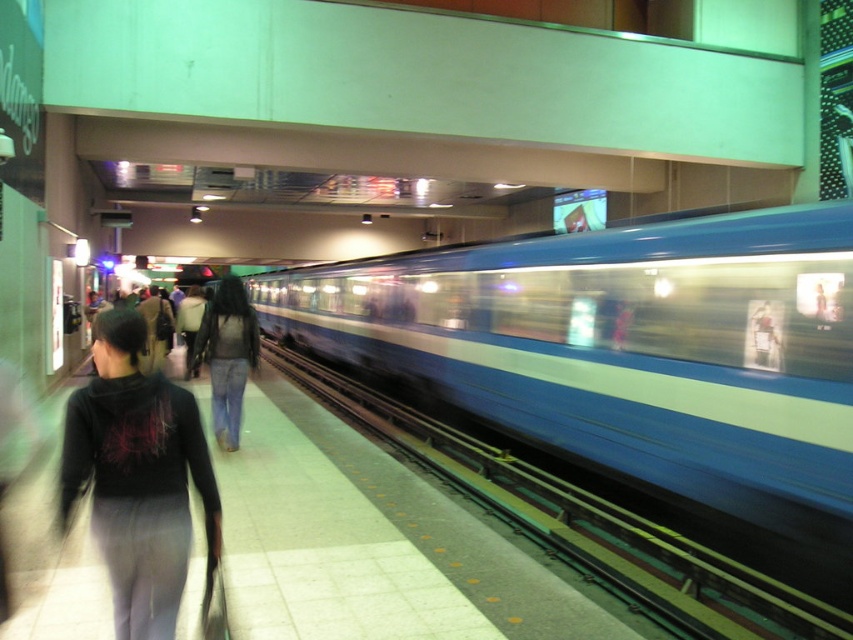
Does dark gray jacket at center appear on the right side of dark blue jeans at center?

Yes, dark gray jacket at center is to the right of dark blue jeans at center.

Does dark gray jacket at center have a smaller size compared to dark blue jeans at center?

Yes, dark gray jacket at center is smaller than dark blue jeans at center.

Consider the image. Who is more forward, [169,337] or [199,321]?

Positioned in front is point [199,321].

You are a GUI agent. You are given a task and a screenshot of the screen. Output one action in this format:
    pyautogui.click(x=<x>, y=<y>)
    Task: Click on the dark gray jacket at center
    This screenshot has height=640, width=853.
    Given the screenshot: What is the action you would take?
    pyautogui.click(x=155, y=330)

Who is shorter, denim jeans at center or dark blue jeans at center?

denim jeans at center

Does denim jeans at center have a greater width compared to dark blue jeans at center?

In fact, denim jeans at center might be narrower than dark blue jeans at center.

This screenshot has height=640, width=853. Find the location of `denim jeans at center`. denim jeans at center is located at coordinates (227, 355).

Who is higher up, denim jeans at center or dark gray jacket at center?

dark gray jacket at center is higher up.

Between denim jeans at center and dark gray jacket at center, which one appears on the left side from the viewer's perspective?

dark gray jacket at center

Is point (225, 328) positioned before point (167, 308)?

That is True.

I want to click on denim jeans at center, so click(227, 355).